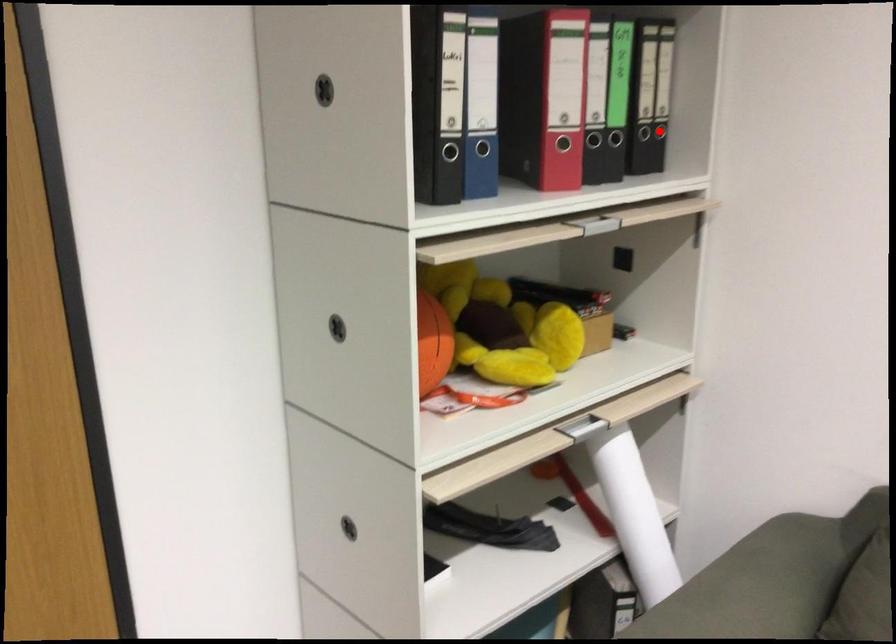
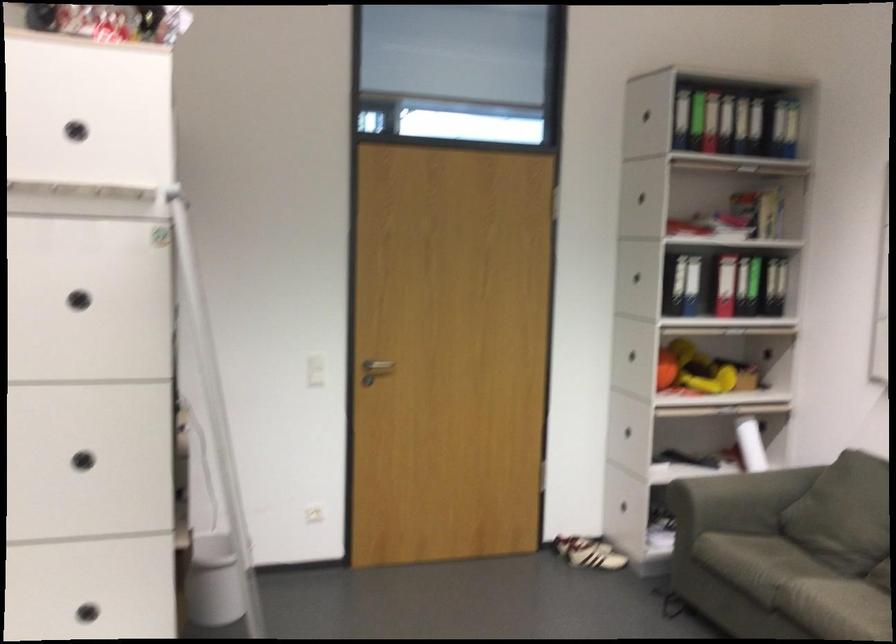
Locate, in the second image, the point that corresponds to the highlighted location in the first image.

(773, 286)